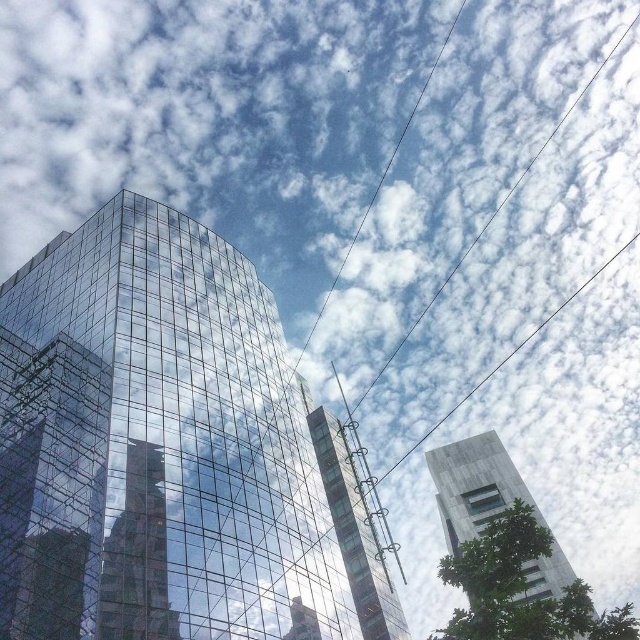
You are an architect analyzing the urban layout. Given the transparent glass building at center and the gray concrete tower at right, which one has a greater horizontal span from left to right edge?

The transparent glass building at center has a greater horizontal span from left to right edge than the gray concrete tower at right because its width surpasses the latter.

You are an architect analyzing the urban layout of the city. You need to determine the exact location of the transparent glass building at center in the image. What are its coordinates?

The transparent glass building at center is located at coordinates point (168, 451).

You are an architect analyzing the urban layout. Based on the scene, which object is positioned higher in the visual hierarchy, the transparent glass building at center or the transparent glass tower at center?

The transparent glass building at center is positioned higher in the visual hierarchy than the transparent glass tower at center because it is located above it.